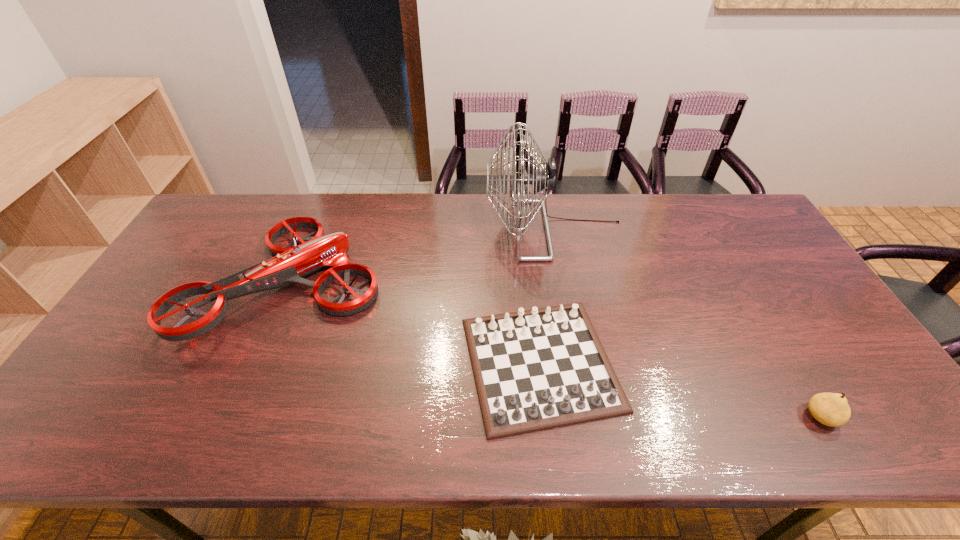
Where is `object that is the third nearest to the chessboard`? This screenshot has width=960, height=540. object that is the third nearest to the chessboard is located at coordinates (831, 409).

Locate which object is the third closest to the chessboard. Please provide its 2D coordinates. Your answer should be formatted as a tuple, i.e. [(x, y)], where the tuple contains the x and y coordinates of a point satisfying the conditions above.

[(831, 409)]

Where is `vacant space that satisfies the following two spatial constraints: 1. on the front-facing side of the tallest object; 2. on the front side of the chessboard`? The image size is (960, 540). vacant space that satisfies the following two spatial constraints: 1. on the front-facing side of the tallest object; 2. on the front side of the chessboard is located at coordinates (580, 363).

You are a GUI agent. You are given a task and a screenshot of the screen. Output one action in this format:
    pyautogui.click(x=<x>, y=<y>)
    Task: Click on the free location that satisfies the following two spatial constraints: 1. on the back side of the pear; 2. on the front-facing side of the tallest object
    
    Given the screenshot: What is the action you would take?
    pyautogui.click(x=711, y=230)

I want to click on blank area in the image that satisfies the following two spatial constraints: 1. on the front-facing side of the fan; 2. on the front side of the leftmost object, so click(x=564, y=281).

The height and width of the screenshot is (540, 960). I want to click on free space that satisfies the following two spatial constraints: 1. on the front-facing side of the tallest object; 2. on the left side of the rightmost object, so click(590, 417).

Image resolution: width=960 pixels, height=540 pixels. Identify the location of free space that satisfies the following two spatial constraints: 1. on the front-facing side of the fan; 2. on the back side of the rightmost object. (590, 417).

The width and height of the screenshot is (960, 540). Find the location of `vacant space that satisfies the following two spatial constraints: 1. on the front-facing side of the pear; 2. on the left side of the fan`. vacant space that satisfies the following two spatial constraints: 1. on the front-facing side of the pear; 2. on the left side of the fan is located at coordinates (590, 417).